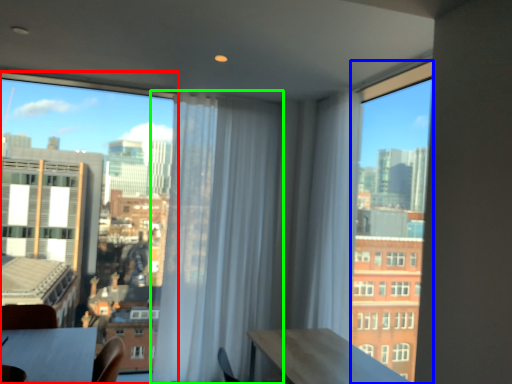
Question: Which object is the farthest from window (highlighted by a red box)? Choose among these: window (highlighted by a blue box) or curtain (highlighted by a green box).

Choices:
 (A) window
 (B) curtain

Answer: (A)